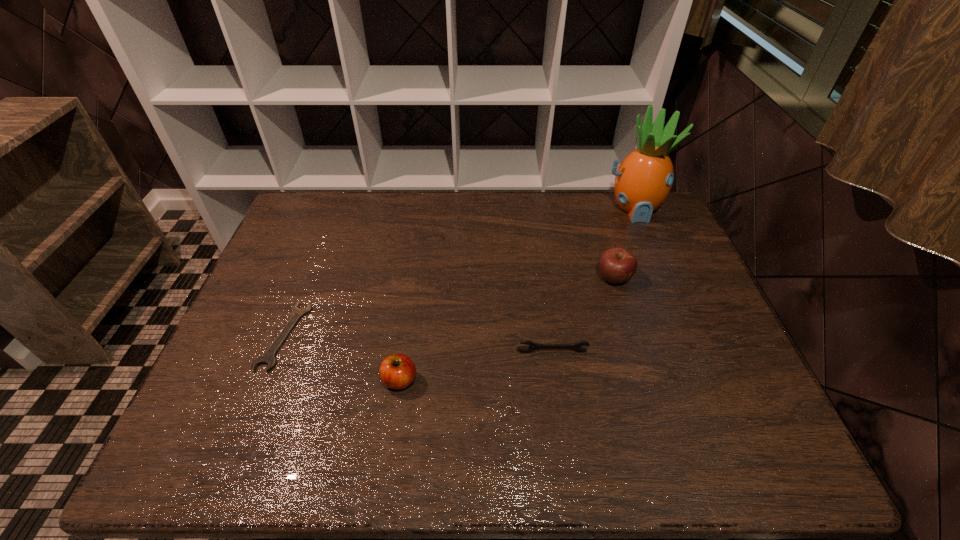
In the image, there is a desktop. At what (x,y) coordinates should I click in order to perform the action: click on vacant space at the near edge. Please return your answer as a coordinate pair (x, y). Looking at the image, I should click on (287, 470).

This screenshot has width=960, height=540. I want to click on vacant point at the left edge, so click(x=300, y=294).

What are the coordinates of `free space at the right edge of the desktop` in the screenshot? It's located at (671, 256).

Where is `free space at the far right corner`? free space at the far right corner is located at coordinates (667, 220).

This screenshot has height=540, width=960. In order to click on vacant space at the near right corner of the desktop in this screenshot , I will do `click(711, 461)`.

Identify the location of vacant point located between the tallest object and the farther apple. (624, 243).

Where is `vacant point located between the right apple and the right wrench`? vacant point located between the right apple and the right wrench is located at coordinates (583, 315).

Where is `empty space between the fourth nearest object and the taller wrench`? The image size is (960, 540). empty space between the fourth nearest object and the taller wrench is located at coordinates (583, 315).

The height and width of the screenshot is (540, 960). I want to click on unoccupied position between the right wrench and the leftmost object, so click(418, 344).

Where is `vacant area between the fourth nearest object and the second object from left to right`? vacant area between the fourth nearest object and the second object from left to right is located at coordinates (507, 329).